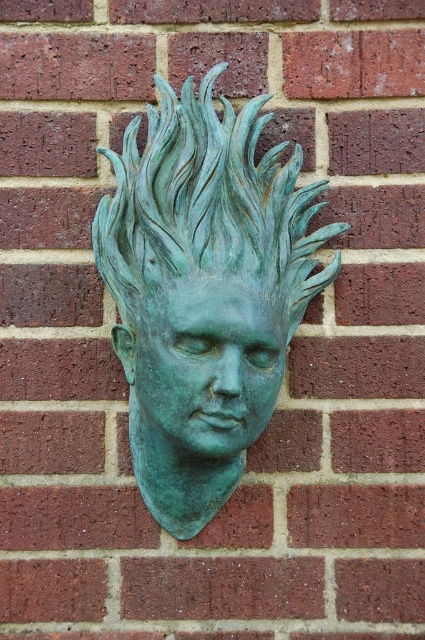
Question: Which point is farther to the camera?

Choices:
 (A) green patina face at center
 (B) green patina bust at center

Answer: (A)

Question: Does green patina bust at center have a greater width compared to green patina face at center?

Choices:
 (A) no
 (B) yes

Answer: (B)

Question: Is green patina bust at center positioned at the back of green patina face at center?

Choices:
 (A) no
 (B) yes

Answer: (A)

Question: Can you confirm if green patina bust at center is bigger than green patina face at center?

Choices:
 (A) no
 (B) yes

Answer: (B)

Question: Which of the following is the closest to the observer?

Choices:
 (A) green patina bust at center
 (B) green patina face at center

Answer: (A)